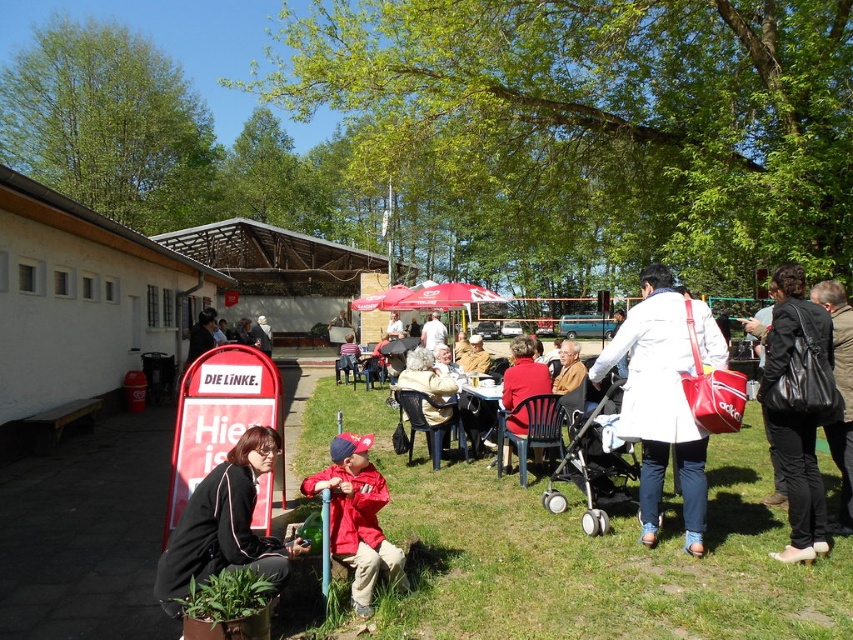
Question: Which of the following is the farthest from the observer?

Choices:
 (A) black leather handbag at right
 (B) wooden picnic table at center

Answer: (B)

Question: Is red matte jacket at lower center closer to the viewer compared to red fabric coat at center?

Choices:
 (A) yes
 (B) no

Answer: (A)

Question: Does white leather coat at center have a smaller size compared to red fabric coat at center?

Choices:
 (A) no
 (B) yes

Answer: (B)

Question: Which point is farther to the camera?

Choices:
 (A) silver metallic stroller at center
 (B) black leather handbag at right

Answer: (A)

Question: Which object is closer to the camera taking this photo?

Choices:
 (A) red fabric umbrella at center
 (B) dark gray coat at center
 (C) red fabric coat at center
 (D) black fabric jacket at lower left

Answer: (D)

Question: Does silver metallic stroller at center have a lesser width compared to red fabric umbrella at center?

Choices:
 (A) yes
 (B) no

Answer: (A)